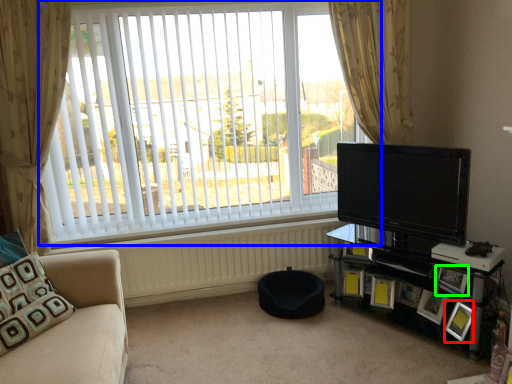
Question: Which object is the farthest from picture frame (highlighted by a red box)? Choose among these: window (highlighted by a blue box) or picture frame (highlighted by a green box).

Choices:
 (A) window
 (B) picture frame

Answer: (A)